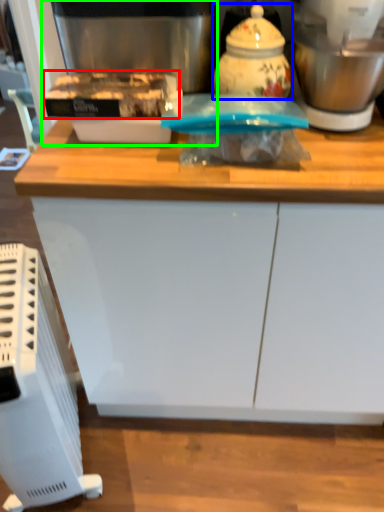
Question: Which is nearer to the food (highlighted by a red box)? kitchen appliance (highlighted by a blue box) or coffee machine (highlighted by a green box).

Choices:
 (A) kitchen appliance
 (B) coffee machine

Answer: (B)